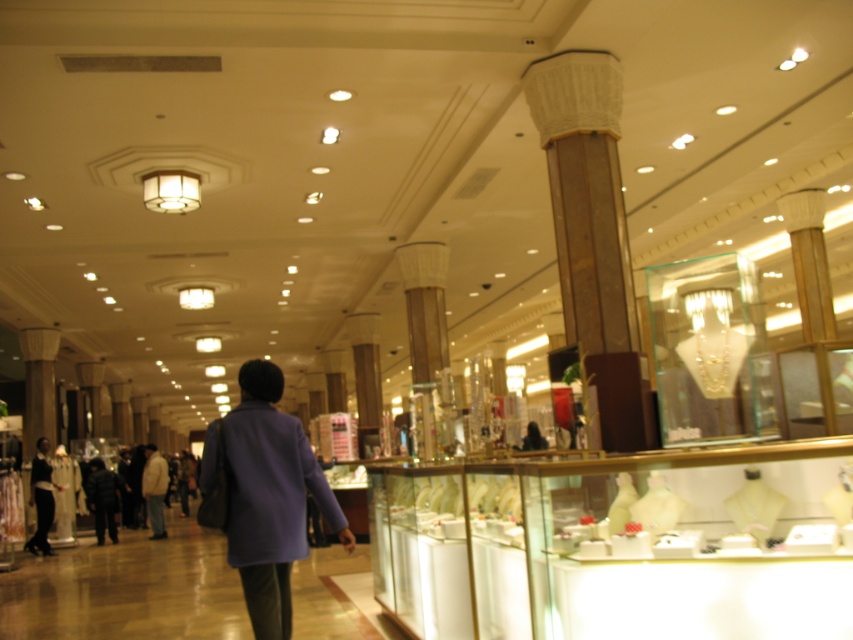
Does purple fabric coat at center have a lesser height compared to dark blue coat at center?

Correct, purple fabric coat at center is not as tall as dark blue coat at center.

From the picture: Does purple fabric coat at center appear over dark blue coat at center?

Yes.

Is point (254, 516) less distant than point (38, 465)?

Yes, point (254, 516) is closer to viewer.

The width and height of the screenshot is (853, 640). I want to click on purple fabric coat at center, so click(267, 493).

Can you confirm if dark blue coat at center is bigger than light beige jacket at center?

Yes.

Does point (32, 467) come farther from viewer compared to point (154, 529)?

No, it is not.

You are a GUI agent. You are given a task and a screenshot of the screen. Output one action in this format:
    pyautogui.click(x=<x>, y=<y>)
    Task: Click on the dark blue coat at center
    The image size is (853, 640).
    Given the screenshot: What is the action you would take?
    pyautogui.click(x=41, y=499)

Where is `dark blue coat at center`? The height and width of the screenshot is (640, 853). dark blue coat at center is located at coordinates (41, 499).

Where is `purple fabric coat at center`? This screenshot has height=640, width=853. purple fabric coat at center is located at coordinates (267, 493).

Is point (262, 438) farther from camera compared to point (161, 528)?

No, (262, 438) is in front of (161, 528).

The height and width of the screenshot is (640, 853). In order to click on purple fabric coat at center in this screenshot , I will do `click(267, 493)`.